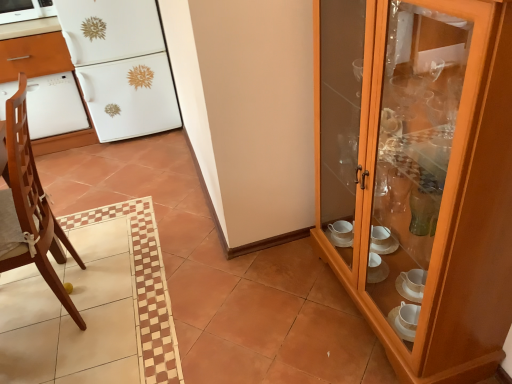
Question: Can you confirm if white glossy oven at left is smaller than wooden cabinet at right?

Choices:
 (A) yes
 (B) no

Answer: (A)

Question: Is white glossy oven at left far away from wooden cabinet at right?

Choices:
 (A) yes
 (B) no

Answer: (A)

Question: Considering the relative sizes of white glossy oven at left and wooden cabinet at right in the image provided, is white glossy oven at left taller than wooden cabinet at right?

Choices:
 (A) no
 (B) yes

Answer: (A)

Question: Is white glossy oven at left shorter than wooden cabinet at right?

Choices:
 (A) no
 (B) yes

Answer: (B)

Question: From a real-world perspective, is white glossy oven at left beneath wooden cabinet at right?

Choices:
 (A) yes
 (B) no

Answer: (A)

Question: Considering the relative positions of white glossy oven at left and wooden cabinet at right in the image provided, is white glossy oven at left behind wooden cabinet at right?

Choices:
 (A) no
 (B) yes

Answer: (B)

Question: Is white glossy microwave at upper left not inside white glossy oven at left?

Choices:
 (A) no
 (B) yes

Answer: (B)

Question: Is white glossy microwave at upper left oriented away from white glossy oven at left?

Choices:
 (A) yes
 (B) no

Answer: (B)

Question: Is white glossy oven at left a part of white glossy microwave at upper left?

Choices:
 (A) no
 (B) yes

Answer: (A)

Question: Can you confirm if white glossy microwave at upper left is smaller than white glossy oven at left?

Choices:
 (A) yes
 (B) no

Answer: (A)

Question: Is white glossy microwave at upper left far away from white glossy oven at left?

Choices:
 (A) no
 (B) yes

Answer: (A)

Question: From the image's perspective, is white glossy microwave at upper left over white glossy oven at left?

Choices:
 (A) no
 (B) yes

Answer: (B)

Question: From the image's perspective, would you say wooden cabinet at right is shown under white glossy dishwasher at left?

Choices:
 (A) yes
 (B) no

Answer: (A)